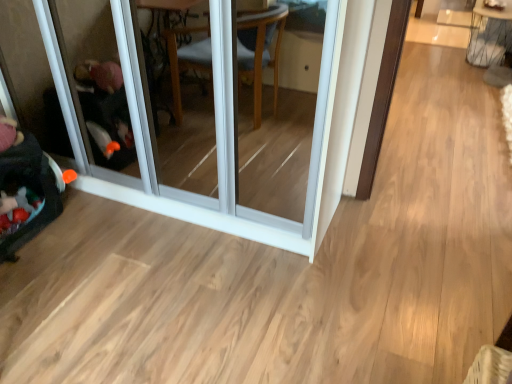
Question: Considering the relative positions of velvet black baby carriage at left and transparent glass screen door at left in the image provided, is velvet black baby carriage at left in front of transparent glass screen door at left?

Choices:
 (A) no
 (B) yes

Answer: (A)

Question: From a real-world perspective, is velvet black baby carriage at left located higher than transparent glass screen door at left?

Choices:
 (A) no
 (B) yes

Answer: (A)

Question: Is velvet black baby carriage at left looking in the opposite direction of transparent glass screen door at left?

Choices:
 (A) no
 (B) yes

Answer: (A)

Question: Is transparent glass screen door at left surrounded by velvet black baby carriage at left?

Choices:
 (A) yes
 (B) no

Answer: (B)

Question: From the image's perspective, does velvet black baby carriage at left appear higher than transparent glass screen door at left?

Choices:
 (A) yes
 (B) no

Answer: (B)

Question: In the image, is metallic wire table at upper right on the left side or the right side of velvet black baby carriage at left?

Choices:
 (A) right
 (B) left

Answer: (A)

Question: Looking at the image, does metallic wire table at upper right seem bigger or smaller compared to velvet black baby carriage at left?

Choices:
 (A) small
 (B) big

Answer: (B)

Question: From the image's perspective, is metallic wire table at upper right positioned above or below velvet black baby carriage at left?

Choices:
 (A) below
 (B) above

Answer: (B)

Question: Is metallic wire table at upper right inside or outside of velvet black baby carriage at left?

Choices:
 (A) inside
 (B) outside

Answer: (B)

Question: Is velvet black baby carriage at left situated inside transparent glass screen door at left or outside?

Choices:
 (A) inside
 (B) outside

Answer: (B)

Question: From the image's perspective, is velvet black baby carriage at left positioned above or below transparent glass screen door at left?

Choices:
 (A) below
 (B) above

Answer: (A)

Question: Based on their positions, is velvet black baby carriage at left located to the left or right of transparent glass screen door at left?

Choices:
 (A) left
 (B) right

Answer: (A)

Question: Is point (6, 233) positioned closer to the camera than point (193, 218)?

Choices:
 (A) closer
 (B) farther

Answer: (A)

Question: From their relative heights in the image, would you say velvet black baby carriage at left is taller or shorter than metallic wire table at upper right?

Choices:
 (A) short
 (B) tall

Answer: (A)

Question: In terms of width, does velvet black baby carriage at left look wider or thinner when compared to metallic wire table at upper right?

Choices:
 (A) thin
 (B) wide

Answer: (A)